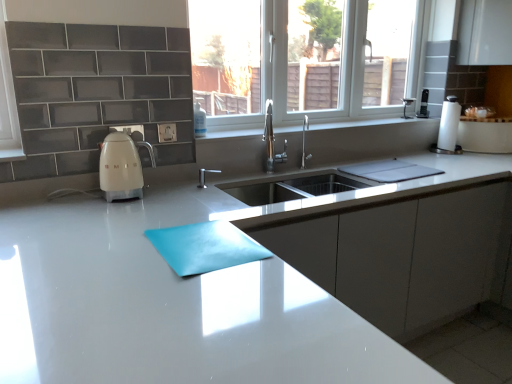
The height and width of the screenshot is (384, 512). In order to click on free space in front of white glossy kettle at left in this screenshot , I will do `click(102, 205)`.